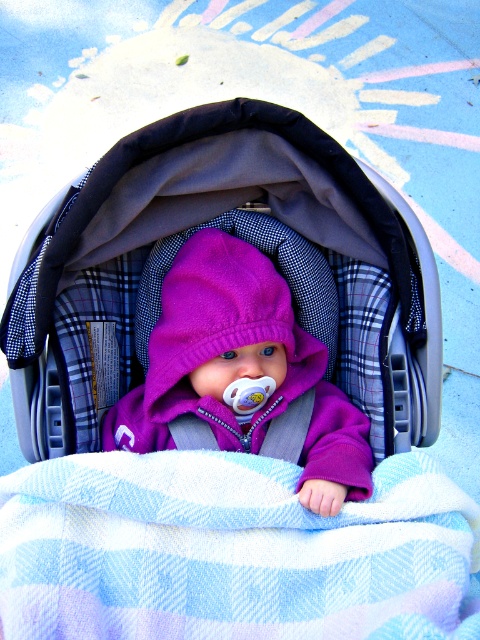
You are a parent trying to ensure your baby stays warm while outside. You have a blue striped blanket at center and a plaid fabric baby carriage at center. Which item should you use to cover the baby more effectively?

The plaid fabric baby carriage at center is positioned over the blue striped blanket at center, so the plaid fabric baby carriage at center would provide better coverage and warmth for the baby.

Based on the scene description, which object is bigger between the plaid fabric baby carriage at center and the purple fleece baby at center?

The plaid fabric baby carriage at center is larger in size than the purple fleece baby at center.

You are a photographer taking a picture of the baby in the car seat. You want to place a small toy at the point labeled as point [228,550]. Based on the scene description, where exactly should you place the toy?

The point [228,550] is located on the blue striped blanket at center, so you should place the toy on the blue striped blanket at center.